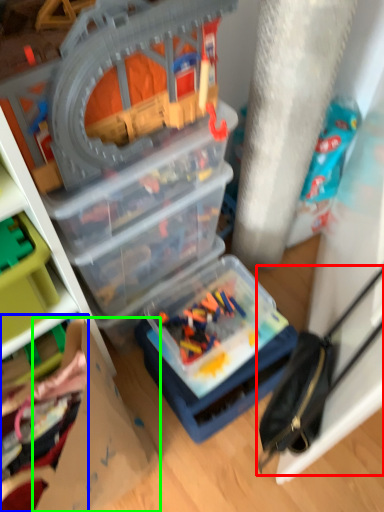
Question: Which is farther away from accessory (highlighted by a red box)? toy (highlighted by a blue box) or cardboard box (highlighted by a green box)?

Choices:
 (A) toy
 (B) cardboard box

Answer: (A)